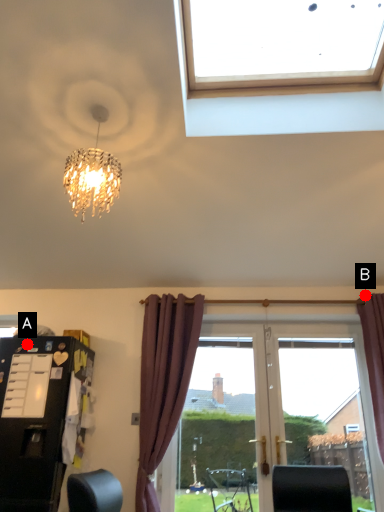
Question: Two points are circled on the image, labeled by A and B beside each circle. Which point is closer to the camera taking this photo?

Choices:
 (A) A is closer
 (B) B is closer

Answer: (A)